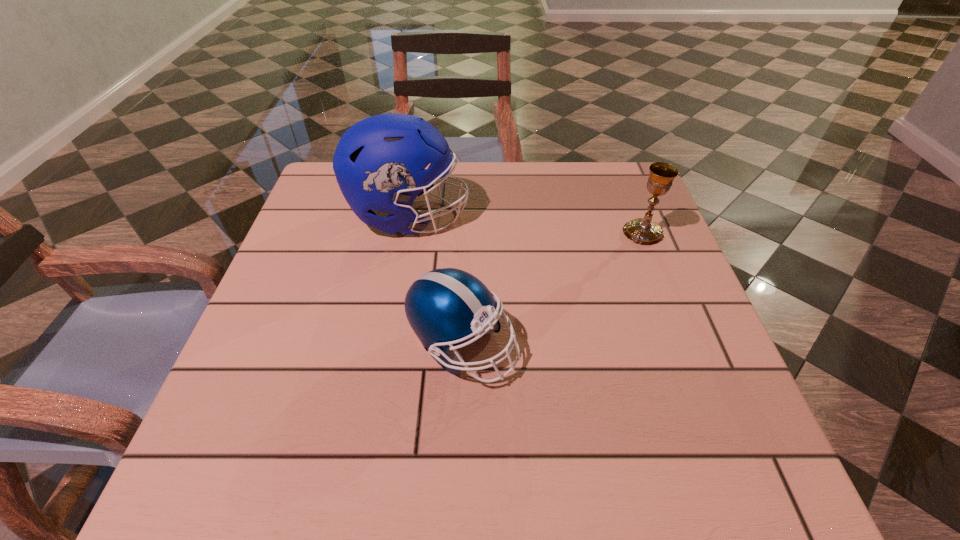
The height and width of the screenshot is (540, 960). I want to click on the tallest object, so click(x=379, y=163).

At what (x,y) coordinates should I click in order to perform the action: click on the taller football helmet. Please return your answer as a coordinate pair (x, y). The height and width of the screenshot is (540, 960). Looking at the image, I should click on (379, 163).

This screenshot has width=960, height=540. In order to click on chalice in this screenshot , I will do `click(645, 231)`.

This screenshot has height=540, width=960. What are the coordinates of `the shorter football helmet` in the screenshot? It's located at (445, 307).

You are a GUI agent. You are given a task and a screenshot of the screen. Output one action in this format:
    pyautogui.click(x=<x>, y=<y>)
    Task: Click on the nearest object
    The height and width of the screenshot is (540, 960).
    Given the screenshot: What is the action you would take?
    pyautogui.click(x=445, y=307)

You are a GUI agent. You are given a task and a screenshot of the screen. Output one action in this format:
    pyautogui.click(x=<x>, y=<y>)
    Task: Click on the vacant space located on the front-facing side of the taller football helmet
    The height and width of the screenshot is (540, 960).
    Given the screenshot: What is the action you would take?
    pyautogui.click(x=552, y=216)

Identify the location of free space located on the front of the rightmost object. This screenshot has width=960, height=540. (699, 373).

What are the coordinates of `vacant area situated at the front of the nearest object with the faceguard` in the screenshot? It's located at (715, 345).

Identify the location of object at the far edge. This screenshot has height=540, width=960. (379, 163).

Identify the location of object located at the left edge. This screenshot has width=960, height=540. (379, 163).